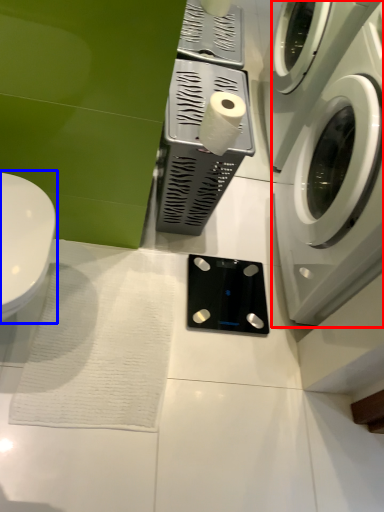
Question: Among these objects, which one is farthest to the camera, washing machine (highlighted by a red box) or toilet (highlighted by a blue box)?

Choices:
 (A) washing machine
 (B) toilet

Answer: (B)